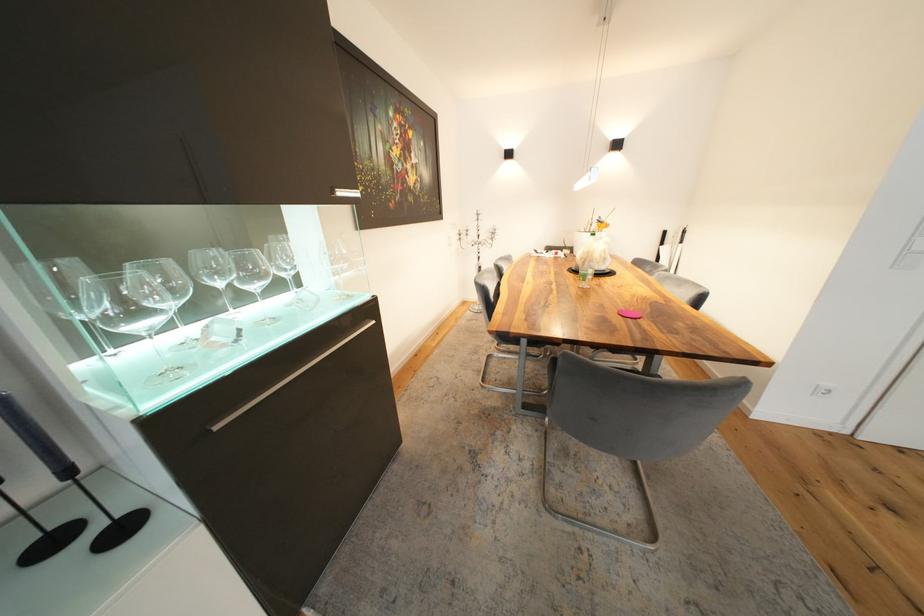
You are a GUI agent. You are given a task and a screenshot of the screen. Output one action in this format:
    pyautogui.click(x=<x>, y=<y>)
    Task: Click on the white bottle
    
    Given the screenshot: What is the action you would take?
    pyautogui.click(x=590, y=259)